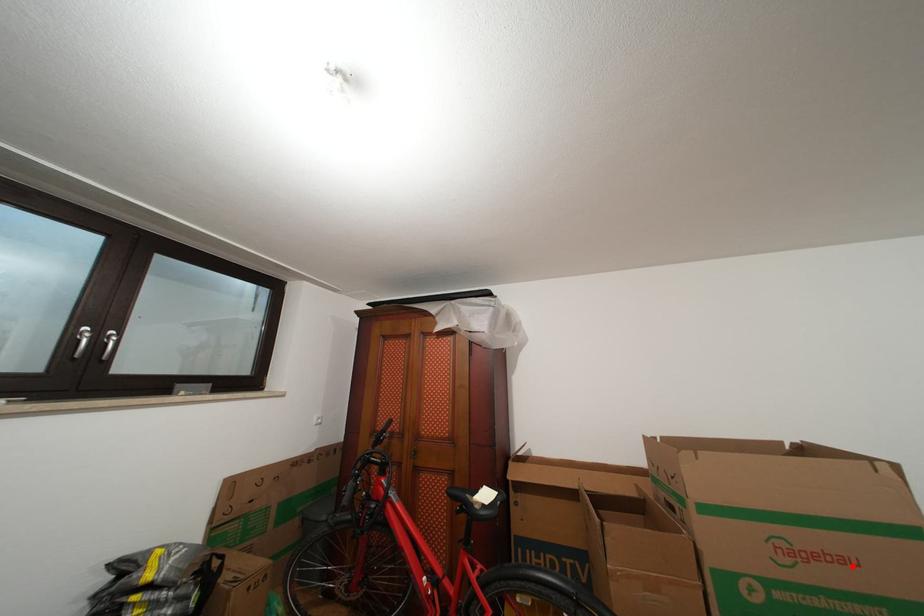
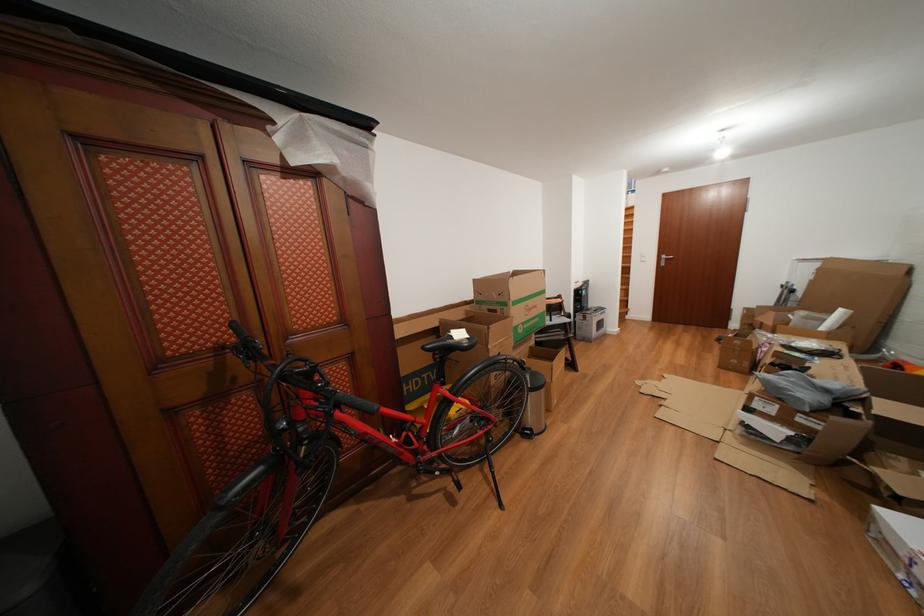
Question: I am providing you with two images of the same scene from different viewpoints. A red point is shown in image1. For the corresponding object point in image2, is it positioned nearer or farther from the camera?

Choices:
 (A) Nearer
 (B) Farther

Answer: (B)